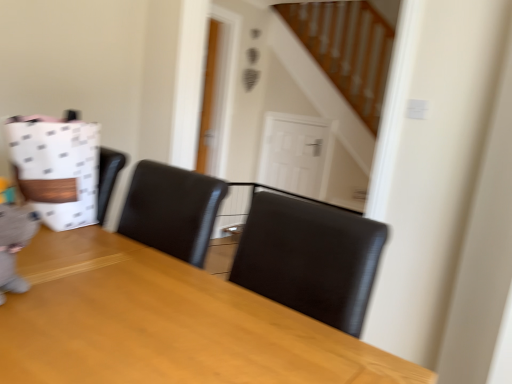
What is the approximate height of white glossy door at center?

white glossy door at center is 74.55 centimeters in height.

Measure the distance between point (320, 153) and camera.

Point (320, 153) is 3.96 meters away from camera.

What do you see at coordinates (165, 324) in the screenshot? I see `wooden table at center` at bounding box center [165, 324].

Find the location of `white glossy door at center`. white glossy door at center is located at coordinates (x=294, y=153).

From the image's perspective, which one is positioned higher, white dotted paper bag at left or wooden table at center?

white dotted paper bag at left appears higher in the image.

From a real-world perspective, who is located higher, white dotted paper bag at left or wooden table at center?

Result: white dotted paper bag at left is physically above.

I want to click on paper bag positioned vertically above the wooden table at center (from a real-world perspective), so click(56, 168).

Between white dotted paper bag at left and wooden table at center, which one is positioned behind?

white dotted paper bag at left.

Considering the positions of points (98, 268) and (270, 150), is point (98, 268) farther from camera compared to point (270, 150)?

No.

Which is more to the left, wooden table at center or white glossy door at center?

wooden table at center.

From a real-world perspective, is wooden table at center physically above white glossy door at center?

No.

Is wooden table at center situated inside white glossy door at center or outside?

wooden table at center is outside white glossy door at center.

Between point (319, 178) and point (57, 275), which one is positioned in front?

The point (57, 275) is in front.

Looking at their sizes, would you say white glossy door at center is wider or thinner than wooden table at center?

Clearly, white glossy door at center has less width compared to wooden table at center.

Is white glossy door at center in front of wooden table at center?

That is False.

Consider the image. From the image's perspective, is white dotted paper bag at left positioned above or below white glossy door at center?

Based on their image positions, white dotted paper bag at left is located beneath white glossy door at center.

Between white dotted paper bag at left and white glossy door at center, which one is positioned behind?

white glossy door at center.

What are the coordinates of `door on the right side of white dotted paper bag at left` in the screenshot? It's located at (294, 153).

From the image's perspective, is wooden table at center located above white dotted paper bag at left?

Incorrect, from the image's perspective, wooden table at center is lower than white dotted paper bag at left.

Are wooden table at center and white dotted paper bag at left beside each other?

No.

Is point (200, 272) closer to camera compared to point (53, 160)?

Yes.

Consider the image. What's the angular difference between wooden table at center and white dotted paper bag at left's facing directions?

They differ by 179 degrees in their facing directions.

Which is in front, point (313, 181) or point (90, 134)?

The point (90, 134) is in front.

Is white glossy door at center positioned with its back to white dotted paper bag at left?

white glossy door at center does not have its back to white dotted paper bag at left.

From a real-world perspective, who is located higher, white glossy door at center or white dotted paper bag at left?

white dotted paper bag at left, from a real-world perspective.

In the image, is white glossy door at center positioned in front of or behind white dotted paper bag at left?

white glossy door at center is behind white dotted paper bag at left.

Identify the location of table below the white dotted paper bag at left (from a real-world perspective). Image resolution: width=512 pixels, height=384 pixels. (165, 324).

Locate an element on the screen. Image resolution: width=512 pixels, height=384 pixels. door behind the wooden table at center is located at coordinates (294, 153).

Considering their positions, is white glossy door at center positioned closer to white dotted paper bag at left than wooden table at center?

wooden table at center is closer to white dotted paper bag at left.

Looking at the image, which one is located further to wooden table at center, white dotted paper bag at left or white glossy door at center?

white glossy door at center is further to wooden table at center.

Looking at the image, which one is located further to wooden table at center, white glossy door at center or white dotted paper bag at left?

Based on the image, white glossy door at center appears to be further to wooden table at center.

Based on the photo, considering their positions, is white dotted paper bag at left positioned closer to white glossy door at center than wooden table at center?

Among the two, white dotted paper bag at left is located nearer to white glossy door at center.

Looking at the image, which one is located closer to white glossy door at center, wooden table at center or white dotted paper bag at left?

Among the two, white dotted paper bag at left is located nearer to white glossy door at center.

Estimate the real-world distances between objects in this image. Which object is further from white dotted paper bag at left, wooden table at center or white glossy door at center?

Based on the image, white glossy door at center appears to be further to white dotted paper bag at left.

I want to click on paper bag between wooden table at center and white glossy door at center in the front-back direction, so [56, 168].